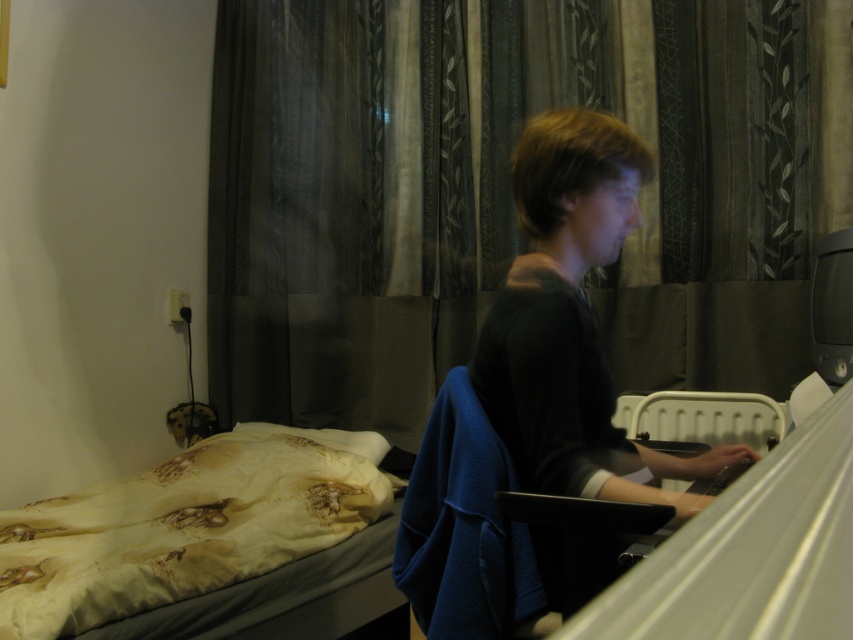
Does dark gray sheer curtain at center have a greater height compared to printed fabric bed at lower left?

Correct, dark gray sheer curtain at center is much taller as printed fabric bed at lower left.

In order to click on dark gray sheer curtain at center in this screenshot , I will do `click(508, 189)`.

Is the position of printed fabric bed at lower left less distant than that of dark gray sweater at center?

No.

Who is positioned more to the right, printed fabric bed at lower left or dark gray sweater at center?

dark gray sweater at center is more to the right.

Between point (160, 561) and point (714, 460), which one is positioned in front?

Point (714, 460) is more forward.

Locate an element on the screen. Image resolution: width=853 pixels, height=640 pixels. printed fabric bed at lower left is located at coordinates (186, 525).

Which is below, dark gray sheer curtain at center or dark gray sweater at center?

dark gray sweater at center is lower down.

Does dark gray sheer curtain at center appear on the right side of dark gray sweater at center?

Incorrect, dark gray sheer curtain at center is not on the right side of dark gray sweater at center.

Find the location of a particular element. The width and height of the screenshot is (853, 640). dark gray sheer curtain at center is located at coordinates (508, 189).